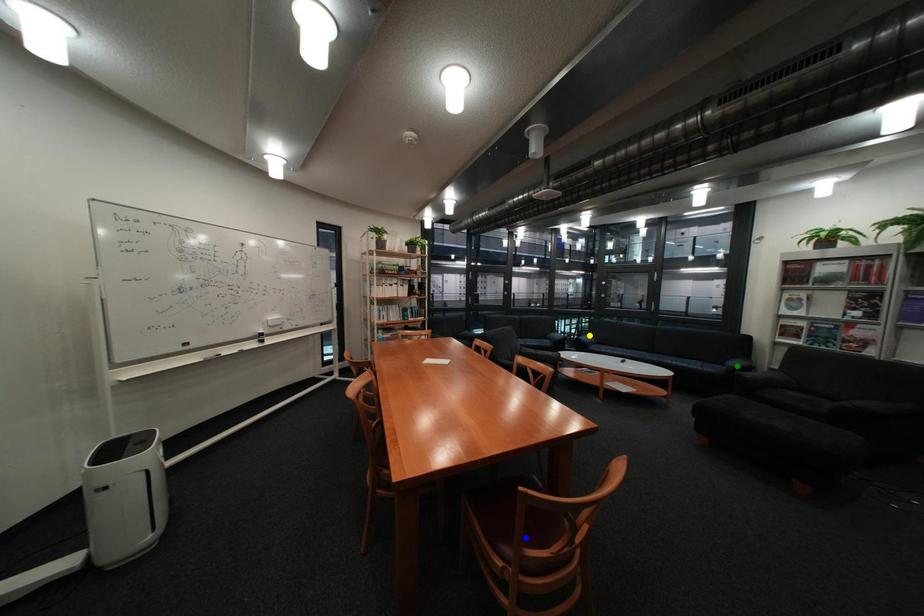
Order these from nearest to farthest:
1. blue point
2. green point
3. yellow point

yellow point < green point < blue point